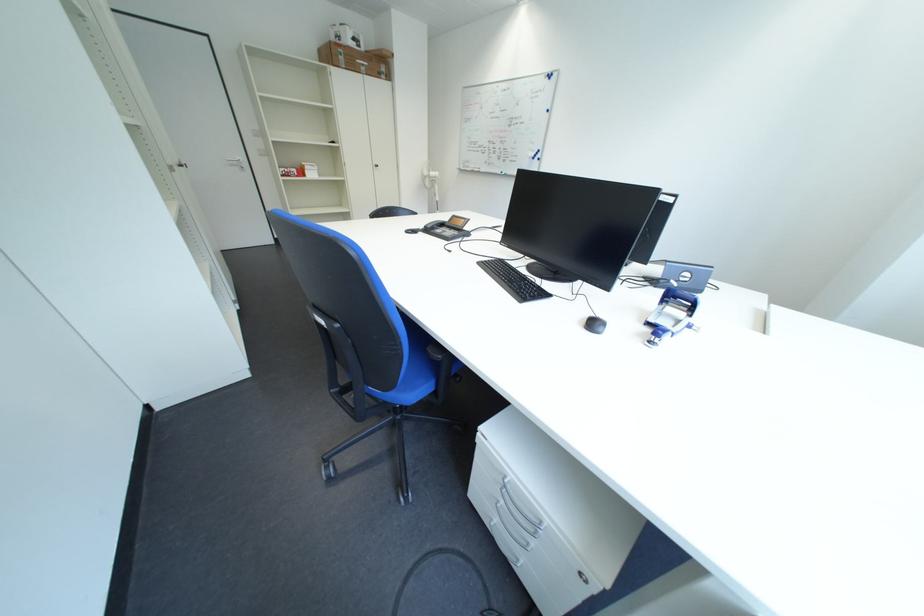
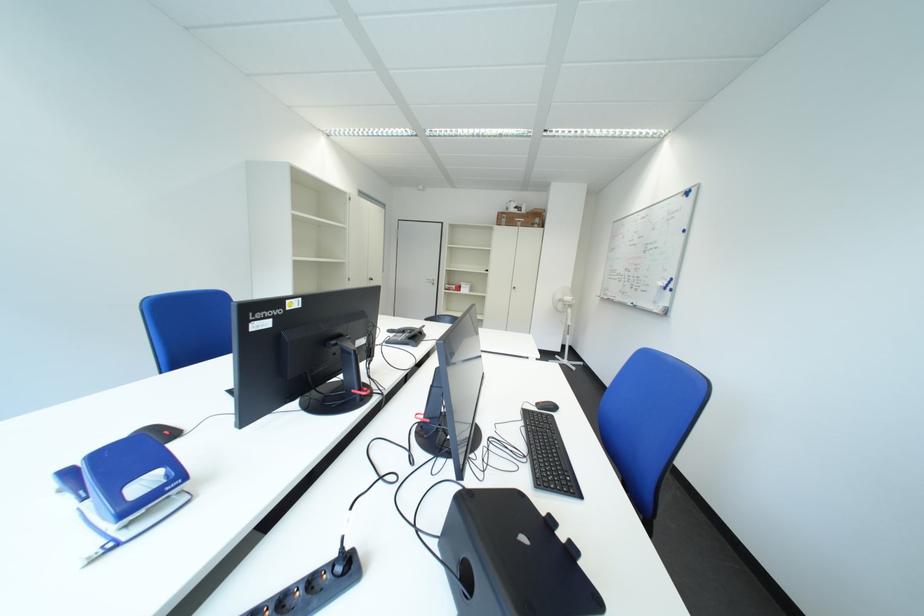
Where in the second image is the point corresponding to (x=354, y=61) from the first image?

(517, 223)